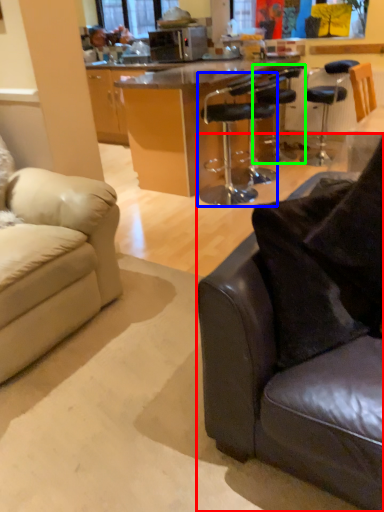
Question: Which object is the closest to the studio couch (highlighted by a red box)? Choose among these: chair (highlighted by a blue box) or chair (highlighted by a green box).

Choices:
 (A) chair
 (B) chair

Answer: (A)